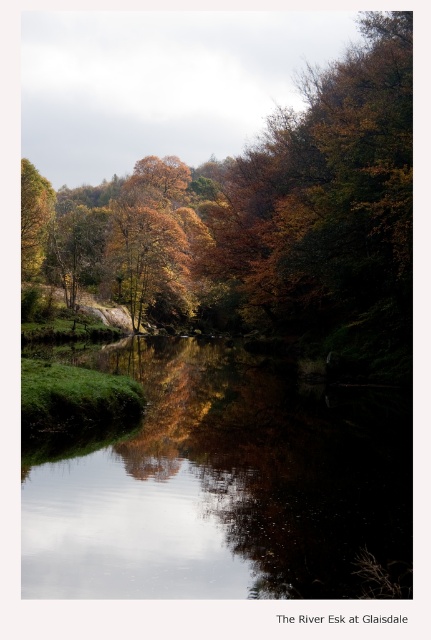
Between smooth reflective water at center and golden leafy trees at center, which one appears on the left side from the viewer's perspective?

Positioned to the left is golden leafy trees at center.

Which is in front, point (62, 552) or point (149, 388)?

Point (62, 552)

You are a GUI agent. You are given a task and a screenshot of the screen. Output one action in this format:
    pyautogui.click(x=<x>, y=<y>)
    Task: Click on the smooth reflective water at center
    This screenshot has width=431, height=640.
    Given the screenshot: What is the action you would take?
    pyautogui.click(x=219, y=484)

Measure the distance between point (199,506) and camera.

Point (199,506) is 12.98 meters away from camera.

How much distance is there between smooth reflective water at center and autumn leaves at upper center?

smooth reflective water at center and autumn leaves at upper center are 168.54 feet apart from each other.

From the picture: Who is more forward, (227, 394) or (99, 289)?

Point (227, 394) is more forward.

Find the location of a particular element. This screenshot has height=640, width=431. smooth reflective water at center is located at coordinates (219, 484).

Who is positioned more to the right, autumn leaves at upper center or golden leafy trees at center?

golden leafy trees at center

From the picture: Is autumn leaves at upper center thinner than golden leafy trees at center?

No.

Does point (352, 177) lie behind point (125, 442)?

Yes, point (352, 177) is farther from viewer.

Find the location of a particular element. autumn leaves at upper center is located at coordinates (259, 216).